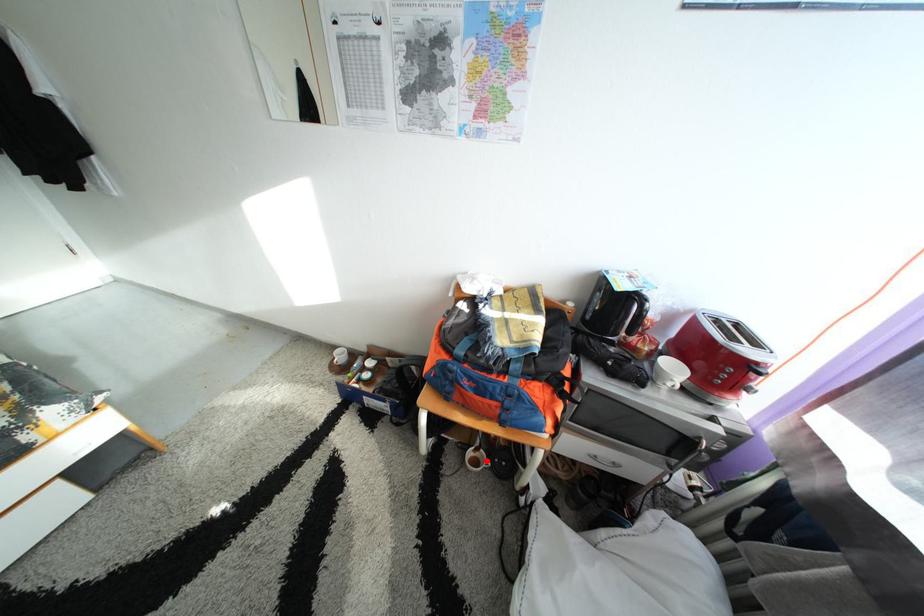
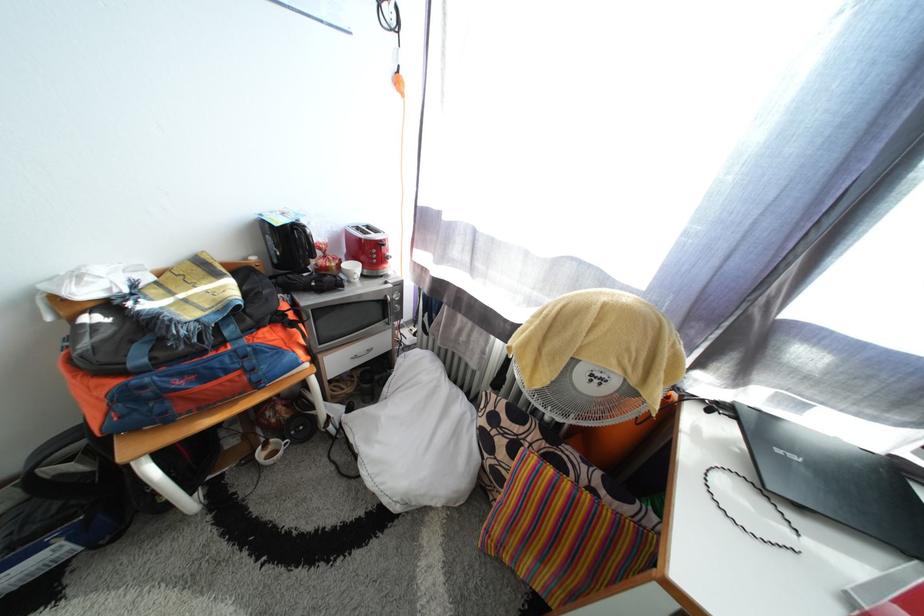
Find the pixel in the second image that matches the highlighted location in the first image.

(280, 455)